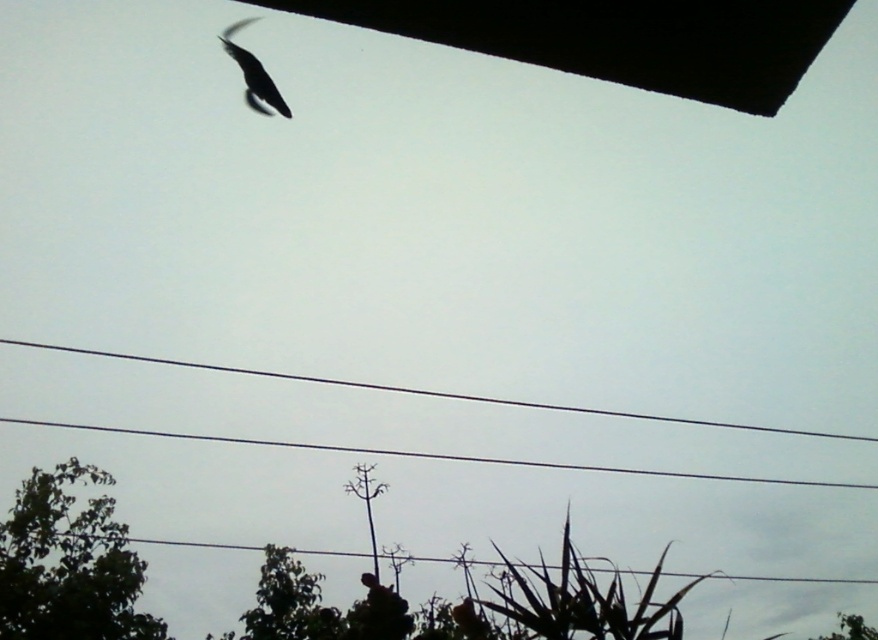
Question: Estimate the real-world distances between objects in this image. Which object is farther from the green leafy tree at lower left?

Choices:
 (A) green leafy tree at lower right
 (B) silvery glossy bird at upper left

Answer: (A)

Question: Which point appears closest to the camera in this image?

Choices:
 (A) (248, 61)
 (B) (70, 612)

Answer: (A)

Question: Which point is closer to the camera taking this photo?

Choices:
 (A) (40, 490)
 (B) (248, 61)

Answer: (B)

Question: Can you confirm if green leafy tree at lower left is positioned above green leafy tree at lower right?

Choices:
 (A) no
 (B) yes

Answer: (B)

Question: Does green leafy tree at lower left come behind silvery glossy bird at upper left?

Choices:
 (A) no
 (B) yes

Answer: (B)

Question: Can you confirm if green leafy tree at lower left is positioned to the right of green leafy tree at lower right?

Choices:
 (A) no
 (B) yes

Answer: (A)